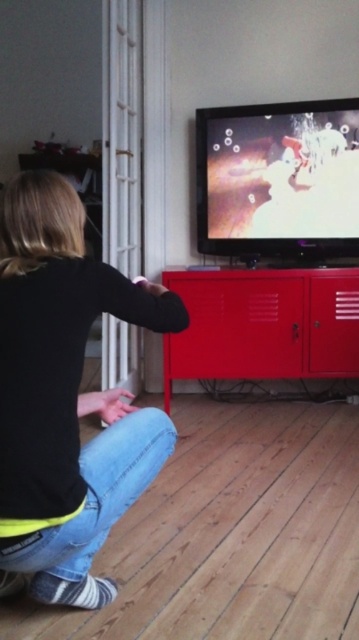
Question: Does black matte shirt at lower left lie behind metallic red cabinet at center?

Choices:
 (A) no
 (B) yes

Answer: (A)

Question: Which object is closer to the camera taking this photo?

Choices:
 (A) black matte shirt at lower left
 (B) metallic red cabinet at center

Answer: (A)

Question: Which object appears farthest from the camera in this image?

Choices:
 (A) metallic red cabinet at center
 (B) black matte shirt at lower left

Answer: (A)

Question: Which object appears farthest from the camera in this image?

Choices:
 (A) metallic red cabinet at center
 (B) black matte shirt at lower left

Answer: (A)

Question: Is black matte shirt at lower left further to the viewer compared to metallic red cabinet at center?

Choices:
 (A) no
 (B) yes

Answer: (A)

Question: Can you confirm if black matte shirt at lower left is positioned to the right of metallic red cabinet at center?

Choices:
 (A) no
 (B) yes

Answer: (A)